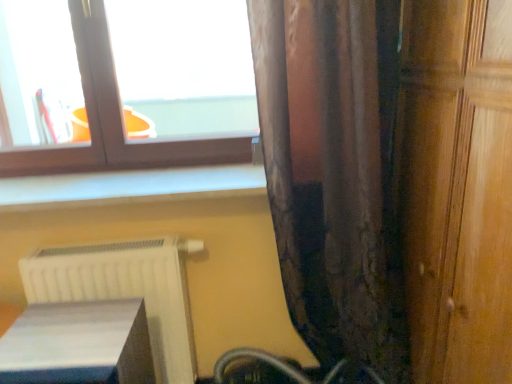
The width and height of the screenshot is (512, 384). I want to click on free space above white glossy book at lower left (from a real-world perspective), so click(74, 337).